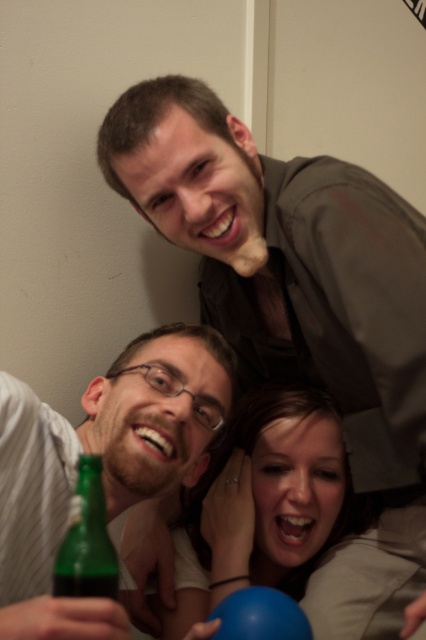
Is point (189, 232) closer to viewer compared to point (26, 416)?

That is False.

Can you confirm if matte brown shirt at upper center is smaller than green matte bottle at lower left?

No.

Is point (368, 435) positioned behind point (198, 406)?

Yes, it is.

I want to click on matte brown shirt at upper center, so click(x=287, y=262).

Which of these two, matte brown shirt at upper center or blue rubber balloon at lower center, stands taller?

matte brown shirt at upper center

Which is behind, point (405, 348) or point (264, 605)?

Point (405, 348)

The width and height of the screenshot is (426, 640). In order to click on matte brown shirt at upper center in this screenshot , I will do `click(287, 262)`.

Is green glass bottle at lower left thinner than blue rubber balloon at lower center?

Correct, green glass bottle at lower left's width is less than blue rubber balloon at lower center's.

Which is below, green glass bottle at lower left or blue rubber balloon at lower center?

blue rubber balloon at lower center

Does point (97, 550) come closer to viewer compared to point (247, 636)?

That is True.

You are a GUI agent. You are given a task and a screenshot of the screen. Output one action in this format:
    pyautogui.click(x=<x>, y=<y>)
    Task: Click on the green glass bottle at lower left
    The image size is (426, 640).
    Given the screenshot: What is the action you would take?
    pyautogui.click(x=86, y=540)